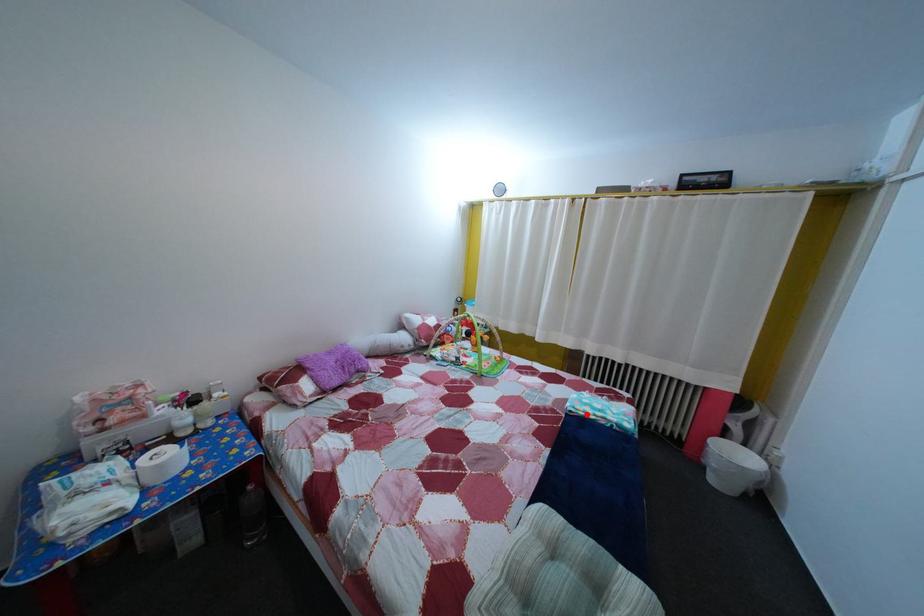
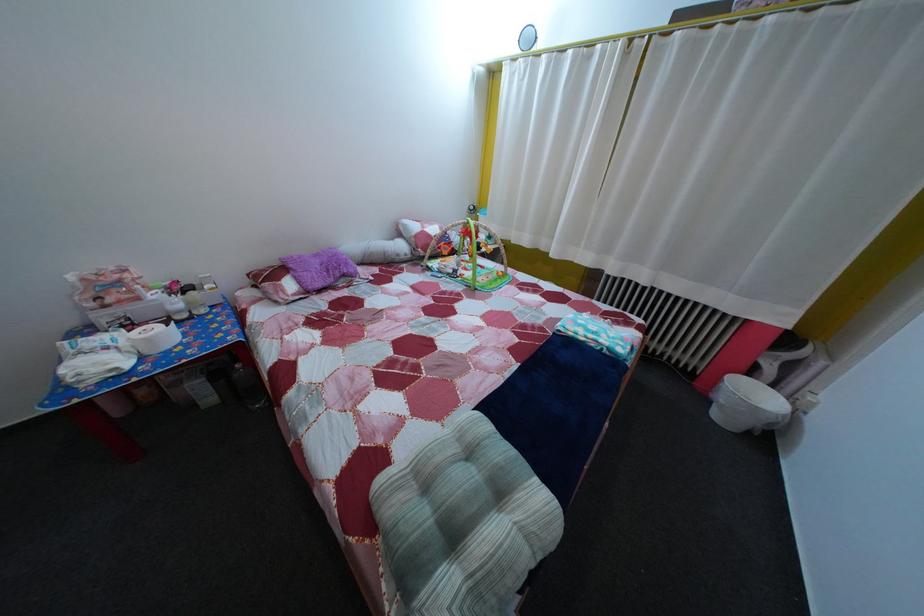
In the second image, find the point that corresponds to the highlighted location in the first image.

(578, 334)